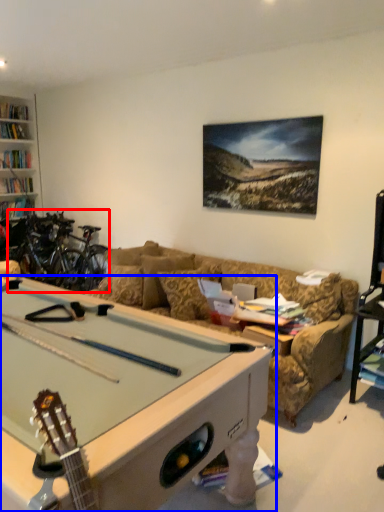
Question: Which of the following is the farthest to the observer, bicycle (highlighted by a red box) or billiard table (highlighted by a blue box)?

Choices:
 (A) bicycle
 (B) billiard table

Answer: (A)